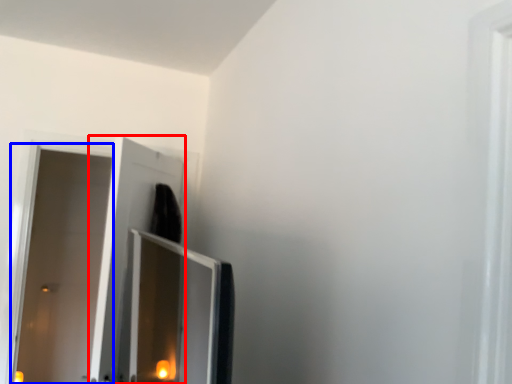
Question: Which object appears closest to the camera in this image, screen door (highlighted by a red box) or door (highlighted by a blue box)?

Choices:
 (A) screen door
 (B) door

Answer: (A)